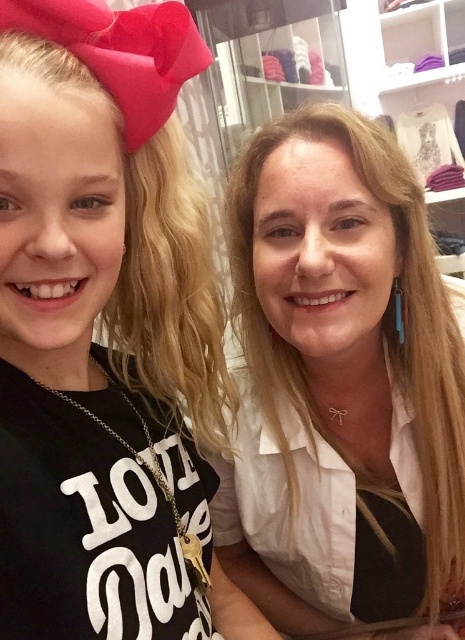
You are a store employee who needs to place a new mannequin that is 5 inches wide between the black matte shirt at left and the white satin blouse at center. Can the mannequin fit in the space between them?

The distance between the black matte shirt at left and the white satin blouse at center is 6.53 inches, so the mannequin that is 5 inches wide can fit in the space between them since it is narrower than the available space.

You are standing at point (422, 592) and want to move to the entrance located at point (114, 205). Is there a clear path between these two points without any obstacles?

Yes, there is a clear path between point (114, 205) and point (422, 592) because the first point is in front of the second one, indicating no obstruction between them.